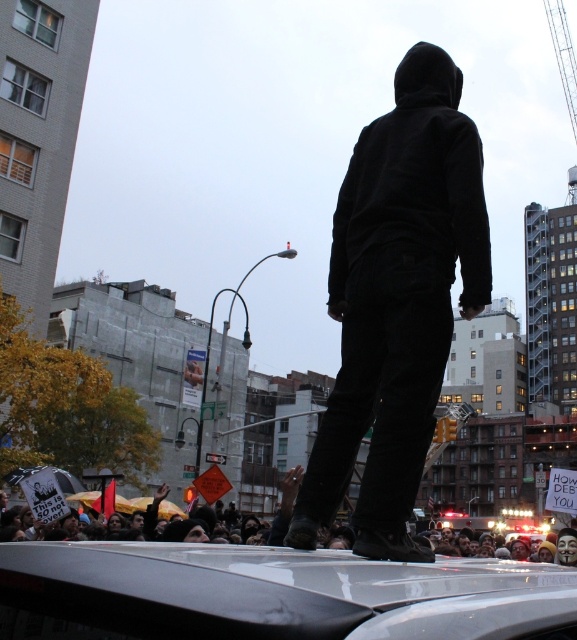
Can you confirm if silver metallic car at center is thinner than black velvety hoodie at upper center?

Incorrect, silver metallic car at center's width is not less than black velvety hoodie at upper center's.

Who is positioned more to the left, silver metallic car at center or black velvety hoodie at upper center?

Positioned to the left is silver metallic car at center.

Is point (141, 616) more distant than point (410, 77)?

That is False.

Identify the location of silver metallic car at center. The width and height of the screenshot is (577, 640). (271, 593).

Consider the image. Who is positioned more to the right, black matte hoodie at center or silver metallic car at center?

black matte hoodie at center

Does black matte hoodie at center appear over silver metallic car at center?

Indeed, black matte hoodie at center is positioned over silver metallic car at center.

Does point (388, 202) come in front of point (569, 584)?

That is False.

I want to click on black matte hoodie at center, so click(396, 301).

Does black matte hoodie at center appear on the right side of black velvety hoodie at upper center?

Incorrect, black matte hoodie at center is not on the right side of black velvety hoodie at upper center.

What do you see at coordinates (396, 301) in the screenshot? The height and width of the screenshot is (640, 577). I see `black matte hoodie at center` at bounding box center [396, 301].

Does point (473, 202) lie behind point (404, 144)?

No, it is in front of (404, 144).

You are a GUI agent. You are given a task and a screenshot of the screen. Output one action in this format:
    pyautogui.click(x=<x>, y=<y>)
    Task: Click on the black matte hoodie at center
    This screenshot has height=640, width=577.
    Given the screenshot: What is the action you would take?
    pyautogui.click(x=396, y=301)